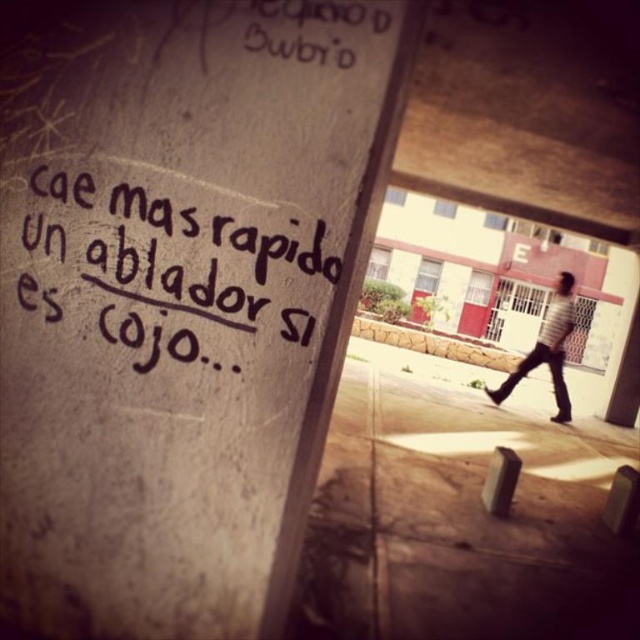
Consider the image. You are a pedestrian walking under the overpass and notice the black painted concrete sign at upper left and the striped shirt at right. Which object is positioned higher from the ground?

The black painted concrete sign at upper left is above the striped shirt at right, so it is positioned higher from the ground.

You are a pedestrian walking on the sidewalk under the overpass. You notice the black handwritten text at center and the striped shirt at right. Which object is positioned higher from the ground?

The black handwritten text at center is above striped shirt at right, so the black handwritten text at center is higher from the ground.

You are standing at the base of the concrete pillar with graffiti and want to look at the black painted concrete sign at upper left. In which direction should you turn your head to see it?

The black painted concrete sign at upper left is located at point (179, 296), which is to the upper left direction from your current position at the base of the pillar. Turn your head towards the upper left to see it.